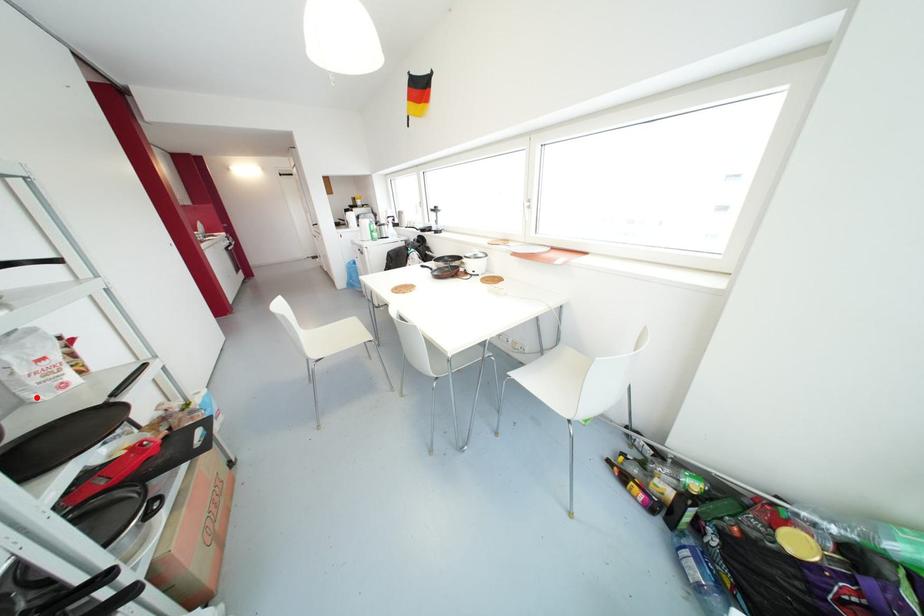
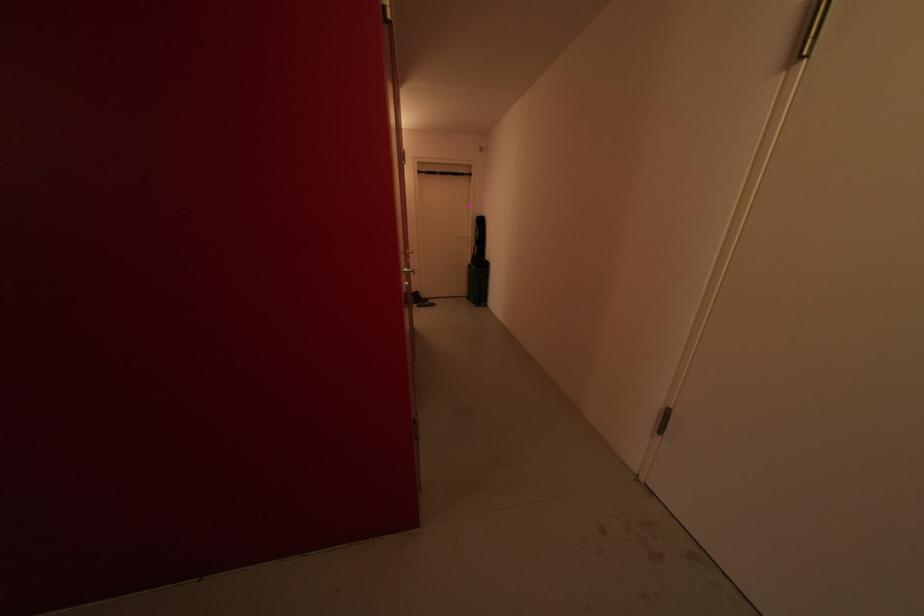
Question: I am providing you with two images of the same scene from different viewpoints. A red point is marked on the first image. Is the red point's position out of view in image 2?

Choices:
 (A) Yes
 (B) No

Answer: (A)